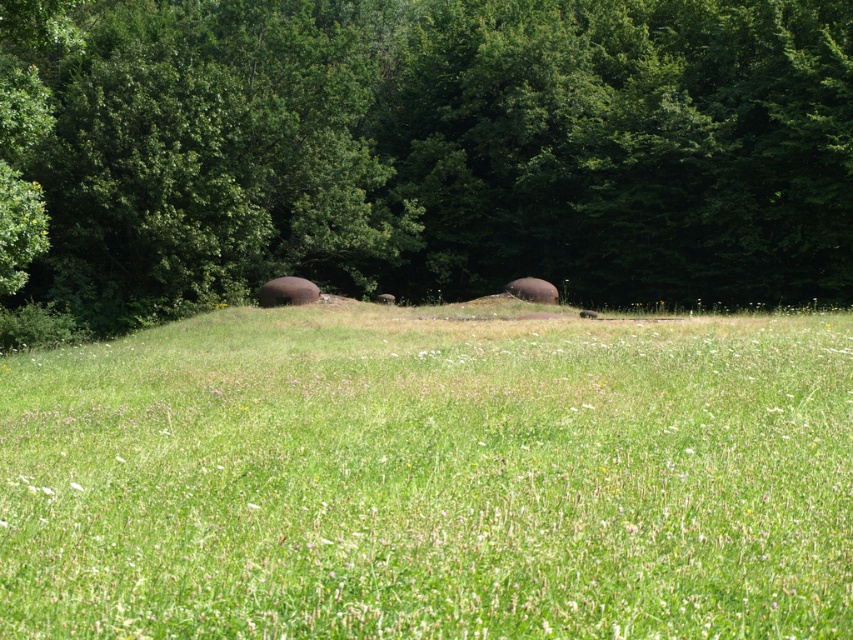
Question: Is green grassy field at center closer to the viewer compared to green leafy tree at upper center?

Choices:
 (A) yes
 (B) no

Answer: (A)

Question: Can you confirm if green grassy field at center is thinner than green leafy tree at upper center?

Choices:
 (A) yes
 (B) no

Answer: (A)

Question: Is green grassy field at center smaller than green leafy tree at upper center?

Choices:
 (A) no
 (B) yes

Answer: (B)